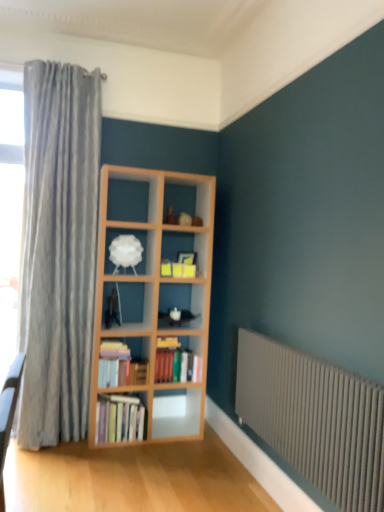
The height and width of the screenshot is (512, 384). I want to click on free spot to the right of hardcover books at center, arranged as the first book when ordered from the bottom, so click(x=156, y=438).